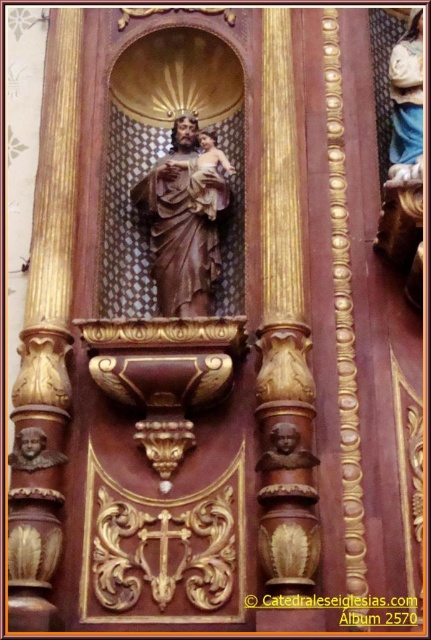
Question: Estimate the real-world distances between objects in this image. Which object is farther from the brown polished wood statue at center?

Choices:
 (A) brown wood bust at center
 (B) matte brown bust at lower left

Answer: (A)

Question: Is brown wood bust at center wider than matte brown bust at lower left?

Choices:
 (A) no
 (B) yes

Answer: (B)

Question: Is brown wood bust at center further to the viewer compared to matte brown bust at lower left?

Choices:
 (A) yes
 (B) no

Answer: (B)

Question: Which of the following is the closest to the observer?

Choices:
 (A) [x=186, y=189]
 (B) [x=25, y=456]

Answer: (B)

Question: Which object is positioned farthest from the matte brown bust at lower left?

Choices:
 (A) brown polished wood statue at center
 (B) brown wood bust at center

Answer: (A)

Question: Observing the image, what is the correct spatial positioning of brown wood bust at center in reference to matte brown bust at lower left?

Choices:
 (A) right
 (B) left

Answer: (A)